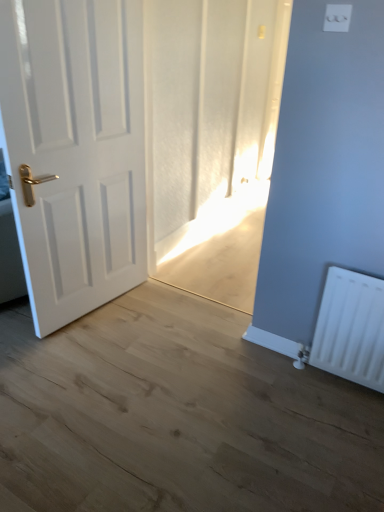
Question: Is white matte door at left facing away from white plastic radiator at lower right?

Choices:
 (A) no
 (B) yes

Answer: (A)

Question: From the image's perspective, is white matte door at left above white plastic radiator at lower right?

Choices:
 (A) yes
 (B) no

Answer: (A)

Question: Can you confirm if white matte door at left is shorter than white plastic radiator at lower right?

Choices:
 (A) yes
 (B) no

Answer: (B)

Question: From a real-world perspective, is white matte door at left over white plastic radiator at lower right?

Choices:
 (A) yes
 (B) no

Answer: (A)

Question: Does white matte door at left touch white plastic radiator at lower right?

Choices:
 (A) no
 (B) yes

Answer: (A)

Question: From a real-world perspective, is white matte door at left positioned above or below white plastic light switch at upper center?

Choices:
 (A) above
 (B) below

Answer: (B)

Question: Relative to white plastic light switch at upper center, is white matte door at left in front or behind?

Choices:
 (A) front
 (B) behind

Answer: (B)

Question: From the image's perspective, is white matte door at left positioned above or below white plastic light switch at upper center?

Choices:
 (A) below
 (B) above

Answer: (A)

Question: Is white matte door at left wider or thinner than white plastic light switch at upper center?

Choices:
 (A) thin
 (B) wide

Answer: (B)

Question: From a real-world perspective, relative to white plastic radiator at lower right, is white plastic light switch at upper center vertically above or below?

Choices:
 (A) below
 (B) above

Answer: (B)

Question: Is white plastic light switch at upper center inside or outside of white plastic radiator at lower right?

Choices:
 (A) outside
 (B) inside

Answer: (A)

Question: Does point (327, 9) appear closer or farther from the camera than point (329, 307)?

Choices:
 (A) farther
 (B) closer

Answer: (B)

Question: In terms of height, does white plastic light switch at upper center look taller or shorter compared to white plastic radiator at lower right?

Choices:
 (A) short
 (B) tall

Answer: (A)

Question: Considering the relative positions of white plastic light switch at upper center and white matte door at left in the image provided, is white plastic light switch at upper center to the left or to the right of white matte door at left?

Choices:
 (A) left
 (B) right

Answer: (B)

Question: Based on their sizes in the image, would you say white plastic light switch at upper center is bigger or smaller than white matte door at left?

Choices:
 (A) big
 (B) small

Answer: (B)